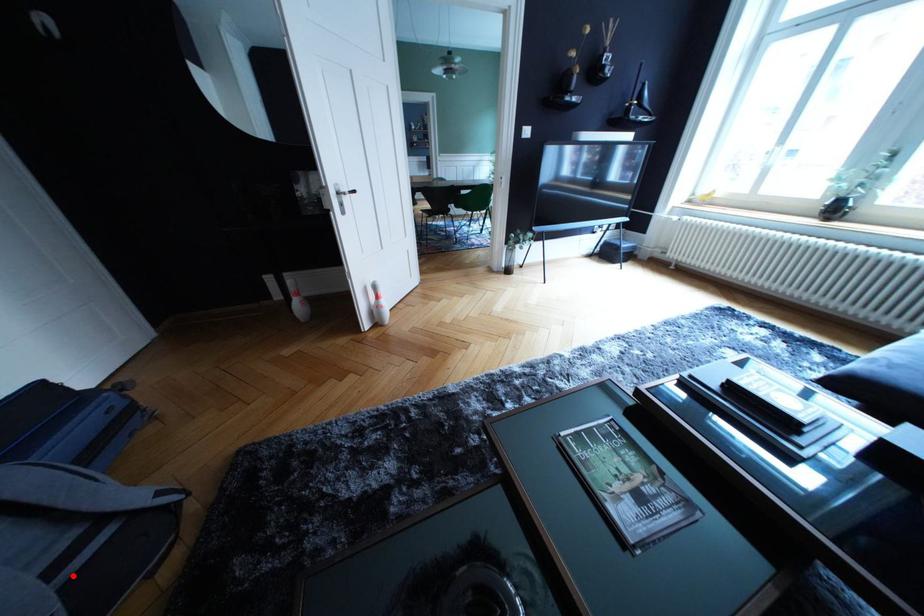
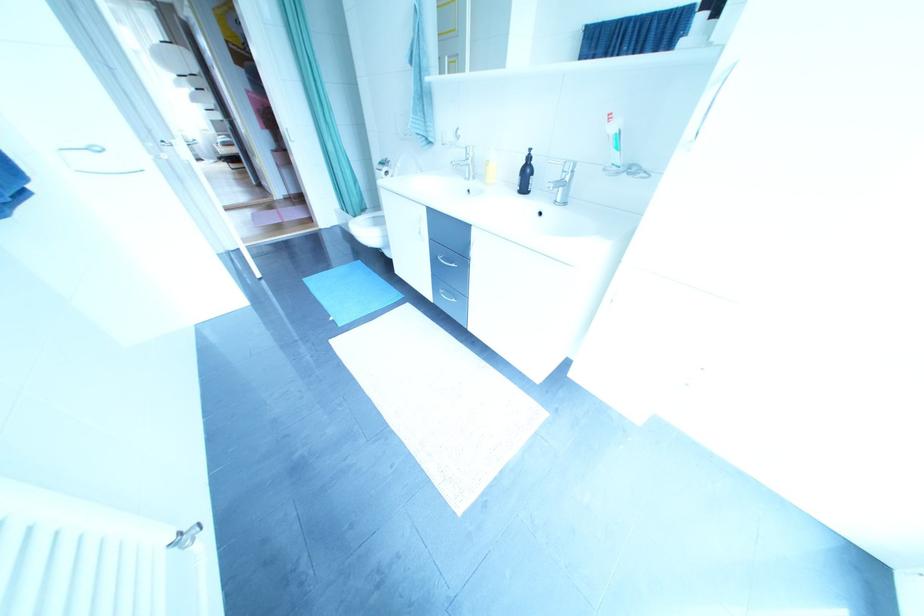
Question: I am providing you with two images of the same scene from different viewpoints. A red point is marked on the first image. Can you still see the location of the red point in image 2?

Choices:
 (A) Yes
 (B) No

Answer: (B)